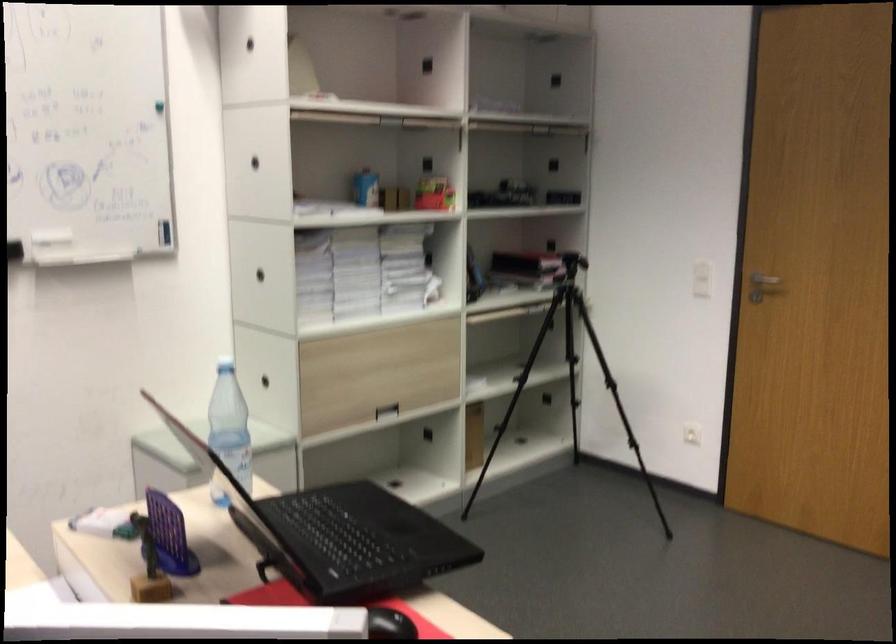
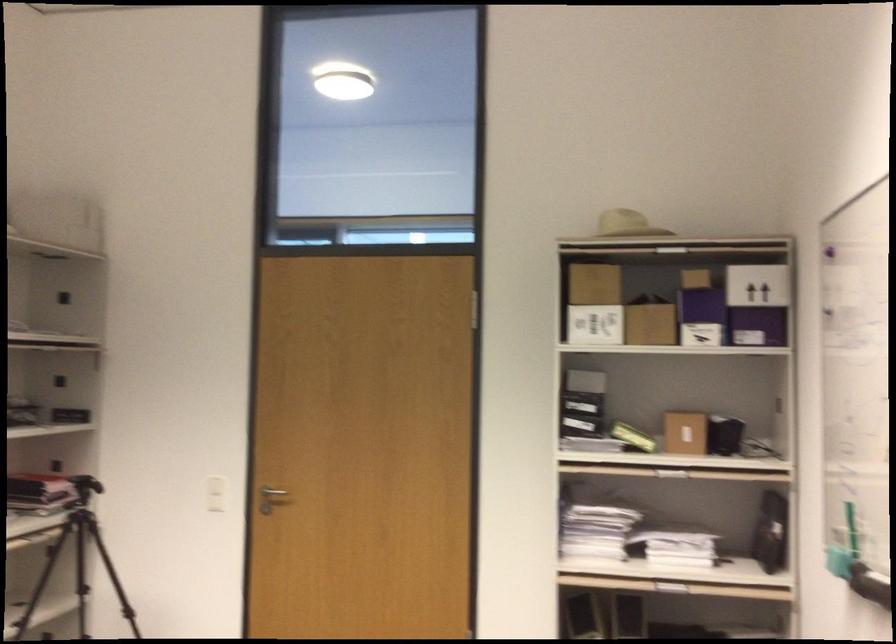
In the second image, find the point that corresponds to [772,279] in the first image.

(272, 491)